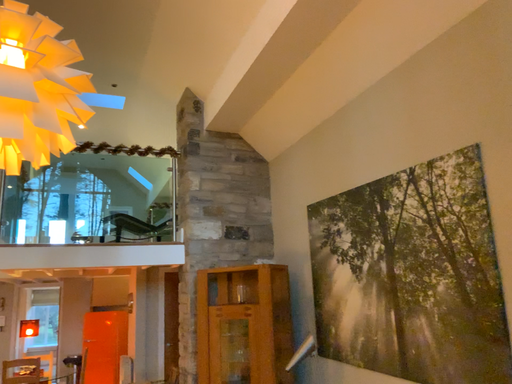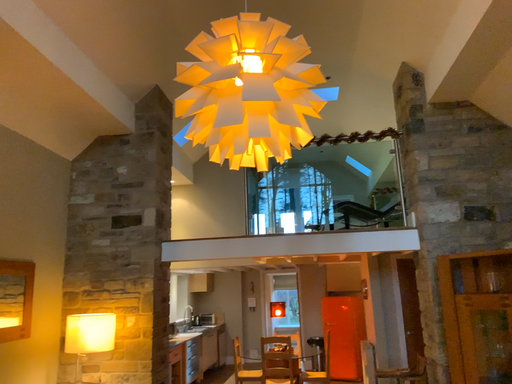
Question: How did the camera likely rotate when shooting the video?

Choices:
 (A) rotated right
 (B) rotated left

Answer: (B)